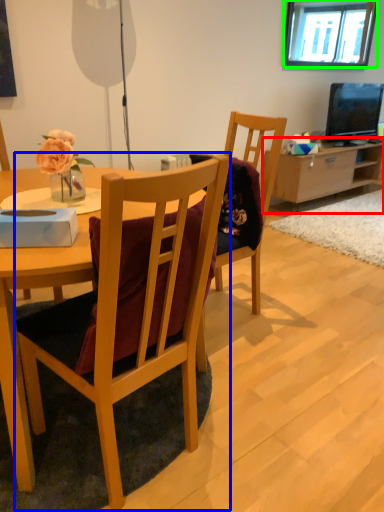
Question: Estimate the real-world distances between objects in this image. Which object is farther from cabinetry (highlighted by a red box), chair (highlighted by a blue box) or window (highlighted by a green box)?

Choices:
 (A) chair
 (B) window

Answer: (A)